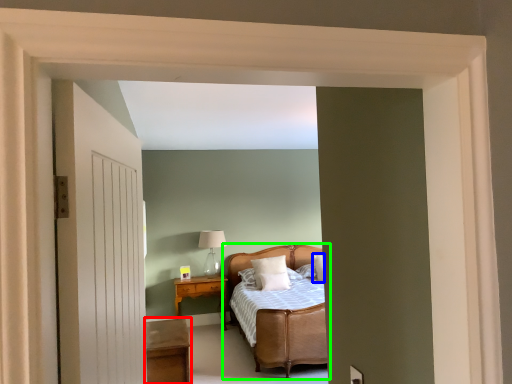
Question: Considering the real-world distances, which object is farthest from table (highlighted by a red box)? pillow (highlighted by a blue box) or bed (highlighted by a green box)?

Choices:
 (A) pillow
 (B) bed

Answer: (A)